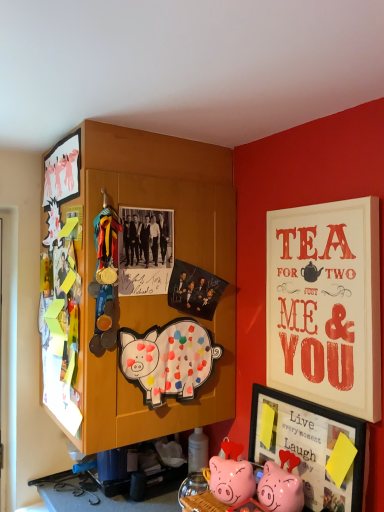
What are the coordinates of `matte black picture frame at lower right, which ranks as the third picture frame in top-to-bottom order` in the screenshot? It's located at (310, 446).

Where is `pink glossy piggy bank at lower center, the first toy in the left-to-right sequence`? pink glossy piggy bank at lower center, the first toy in the left-to-right sequence is located at coordinates (230, 475).

What do you see at coordinates (168, 359) in the screenshot?
I see `painted paper pig at center` at bounding box center [168, 359].

The width and height of the screenshot is (384, 512). What do you see at coordinates (281, 485) in the screenshot?
I see `pink glossy piggy bank at lower center, which is counted as the second toy, starting from the left` at bounding box center [281, 485].

In order to face pink glossy piggy bank at lower center, which ranks as the first toy in right-to-left order, should I rotate leftwards or rightwards?

You should rotate right by 11.443 degrees.

I want to click on matte black picture frame at lower right, which ranks as the third picture frame in top-to-bottom order, so click(310, 446).

Which object is further away from the camera taking this photo, matte white signboard at upper right, which ranks as the first picture frame in right-to-left order, or pink glossy piggy bank at lower center, which ranks as the first toy in right-to-left order?

pink glossy piggy bank at lower center, which ranks as the first toy in right-to-left order, is more distant.

Based on the photo, considering the relative sizes of matte white signboard at upper right, which ranks as the first picture frame in right-to-left order, and pink glossy piggy bank at lower center, which ranks as the first toy in right-to-left order, in the image provided, is matte white signboard at upper right, which ranks as the first picture frame in right-to-left order, taller than pink glossy piggy bank at lower center, which ranks as the first toy in right-to-left order,?

Yes, matte white signboard at upper right, which ranks as the first picture frame in right-to-left order, is taller than pink glossy piggy bank at lower center, which ranks as the first toy in right-to-left order.

I want to click on toy that is the 1st object to the left of the matte white signboard at upper right, acting as the 2th picture frame starting from the bottom, starting at the anchor, so click(x=281, y=485).

Would you say wooden cabinet at upper left is a long distance from matte white signboard at upper right, which is the 2th picture frame in top-to-bottom order?

No, there isn't a large distance between wooden cabinet at upper left and matte white signboard at upper right, which is the 2th picture frame in top-to-bottom order.

Based on the photo, from a real-world perspective, is wooden cabinet at upper left positioned over matte white signboard at upper right, acting as the 2th picture frame starting from the bottom, based on gravity?

Yes, from a real-world perspective, wooden cabinet at upper left is on top of matte white signboard at upper right, acting as the 2th picture frame starting from the bottom.

From the image's perspective, is wooden cabinet at upper left located above or below matte white signboard at upper right, which is the 2th picture frame in top-to-bottom order?

Clearly, from the image's perspective, wooden cabinet at upper left is above matte white signboard at upper right, which is the 2th picture frame in top-to-bottom order.

How much distance is there between wooden cabinet at upper left and matte white signboard at upper right, acting as the 2th picture frame starting from the bottom?

A distance of 17.27 inches exists between wooden cabinet at upper left and matte white signboard at upper right, acting as the 2th picture frame starting from the bottom.

How different are the orientations of matte white picture frame at upper left, acting as the first picture frame starting from the top, and wooden cabinet at upper left in degrees?

90.9 degrees.

Is matte white picture frame at upper left, the 3th picture frame positioned from the right, looking in the opposite direction of wooden cabinet at upper left?

That's right, matte white picture frame at upper left, the 3th picture frame positioned from the right, is facing away from wooden cabinet at upper left.

Which is in front, wooden cabinet at upper left or pink glossy piggy bank at lower center, the first toy in the left-to-right sequence?

pink glossy piggy bank at lower center, the first toy in the left-to-right sequence, is in front.

Does point (132, 170) come farther from viewer compared to point (213, 480)?

Yes, point (132, 170) is behind point (213, 480).

You are a GUI agent. You are given a task and a screenshot of the screen. Output one action in this format:
    pyautogui.click(x=<x>, y=<y>)
    Task: Click on the cabinetry on the left of pink glossy piggy bank at lower center, the first toy in the left-to-right sequence
    The image size is (384, 512).
    Given the screenshot: What is the action you would take?
    pyautogui.click(x=174, y=254)

From a real-world perspective, which picture frame is the 1st one above the matte black picture frame at lower right, the 2th picture frame when ordered from right to left? Please provide its 2D coordinates.

[(326, 305)]

Is point (314, 447) closer to camera compared to point (290, 281)?

Yes, point (314, 447) is in front of point (290, 281).

From the picture: From the image's perspective, would you say matte black picture frame at lower right, the first picture frame positioned from the bottom, is shown under matte white signboard at upper right, which is the 2th picture frame in top-to-bottom order?

Correct, matte black picture frame at lower right, the first picture frame positioned from the bottom, appears lower than matte white signboard at upper right, which is the 2th picture frame in top-to-bottom order, in the image.

Is matte white signboard at upper right, the 3th picture frame when ordered from left to right, completely or partially inside matte black picture frame at lower right, which ranks as the third picture frame in top-to-bottom order?

Definitely not — matte white signboard at upper right, the 3th picture frame when ordered from left to right, is not inside matte black picture frame at lower right, which ranks as the third picture frame in top-to-bottom order.

In the image, is matte white signboard at upper right, which is the 2th picture frame in top-to-bottom order, on the left side or the right side of painted paper pig at center?

matte white signboard at upper right, which is the 2th picture frame in top-to-bottom order, is to the right of painted paper pig at center.

Is painted paper pig at center inside matte white signboard at upper right, acting as the 2th picture frame starting from the bottom?

Definitely not — painted paper pig at center is not inside matte white signboard at upper right, acting as the 2th picture frame starting from the bottom.

Consider the image. Considering the sizes of objects matte white signboard at upper right, which ranks as the first picture frame in right-to-left order, and painted paper pig at center in the image provided, who is taller, matte white signboard at upper right, which ranks as the first picture frame in right-to-left order, or painted paper pig at center?

With more height is matte white signboard at upper right, which ranks as the first picture frame in right-to-left order.

Is matte white signboard at upper right, which is the 2th picture frame in top-to-bottom order, positioned with its back to painted paper pig at center?

No, painted paper pig at center is not at the back of matte white signboard at upper right, which is the 2th picture frame in top-to-bottom order.

Between matte black picture frame at lower right, the 2th picture frame when ordered from right to left, and pink glossy piggy bank at lower center, which ranks as the first toy in right-to-left order, which one has more height?

Standing taller between the two is matte black picture frame at lower right, the 2th picture frame when ordered from right to left.

Is matte black picture frame at lower right, the 2th picture frame when ordered from right to left, positioned far away from pink glossy piggy bank at lower center, which ranks as the first toy in right-to-left order?

No, matte black picture frame at lower right, the 2th picture frame when ordered from right to left, is not far away from pink glossy piggy bank at lower center, which ranks as the first toy in right-to-left order.

From the image's perspective, relative to pink glossy piggy bank at lower center, which ranks as the first toy in right-to-left order, is matte black picture frame at lower right, which is the second picture frame in left-to-right order, above or below?

matte black picture frame at lower right, which is the second picture frame in left-to-right order, is situated higher than pink glossy piggy bank at lower center, which ranks as the first toy in right-to-left order, in the image.

Considering the points (287, 397) and (266, 500), which point is behind, point (287, 397) or point (266, 500)?

Point (287, 397)

Starting from the pink glossy piggy bank at lower center, which ranks as the first toy in right-to-left order, which picture frame is the 2nd one to the right? Please provide its 2D coordinates.

[(326, 305)]

This screenshot has width=384, height=512. What are the coordinates of `cabinetry above the matte white signboard at upper right, which is the 2th picture frame in top-to-bottom order (from the image's perspective)` in the screenshot? It's located at (174, 254).

Considering their positions, is matte white picture frame at upper left, the first picture frame viewed from the left, positioned further to matte black photo at upper center than painted paper pig at center?

The object further to matte black photo at upper center is matte white picture frame at upper left, the first picture frame viewed from the left.

When comparing their distances from pink glossy piggy bank at lower center, which is counted as the second toy, starting from the left, does matte white signboard at upper right, which is the 2th picture frame in top-to-bottom order, or pink glossy piggy bank at lower center, the first toy in the left-to-right sequence, seem further?

matte white signboard at upper right, which is the 2th picture frame in top-to-bottom order, is further to pink glossy piggy bank at lower center, which is counted as the second toy, starting from the left.

From the image, which object appears to be nearer to painted paper pig at center, pink glossy piggy bank at lower center, which ranks as the first toy in right-to-left order, or matte white signboard at upper right, acting as the 2th picture frame starting from the bottom?

matte white signboard at upper right, acting as the 2th picture frame starting from the bottom, lies closer to painted paper pig at center than the other object.

Looking at the image, which one is located closer to matte black picture frame at lower right, the first picture frame positioned from the bottom, wooden cabinet at upper left or matte black photo at upper center?

wooden cabinet at upper left is closer to matte black picture frame at lower right, the first picture frame positioned from the bottom.

Based on their spatial positions, is matte white signboard at upper right, which ranks as the first picture frame in right-to-left order, or pink glossy piggy bank at lower center, which ranks as the first toy in right-to-left order, closer to pink glossy piggy bank at lower center, the first toy in the left-to-right sequence?

The object closer to pink glossy piggy bank at lower center, the first toy in the left-to-right sequence, is pink glossy piggy bank at lower center, which ranks as the first toy in right-to-left order.

Which object lies nearer to the anchor point pink glossy piggy bank at lower center, which ranks as the first toy in right-to-left order, wooden cabinet at upper left or matte white signboard at upper right, acting as the 2th picture frame starting from the bottom?

Among the two, matte white signboard at upper right, acting as the 2th picture frame starting from the bottom, is located nearer to pink glossy piggy bank at lower center, which ranks as the first toy in right-to-left order.

Estimate the real-world distances between objects in this image. Which object is further from pink glossy piggy bank at lower center, the second toy positioned from the right, matte white picture frame at upper left, which is counted as the third picture frame, starting from the bottom, or painted paper pig at center?

matte white picture frame at upper left, which is counted as the third picture frame, starting from the bottom.

Considering their positions, is pink glossy piggy bank at lower center, the first toy in the left-to-right sequence, positioned further to wooden cabinet at upper left than painted paper pig at center?

Based on the image, pink glossy piggy bank at lower center, the first toy in the left-to-right sequence, appears to be further to wooden cabinet at upper left.

The height and width of the screenshot is (512, 384). I want to click on pig between matte white picture frame at upper left, the 3th picture frame positioned from the right, and pink glossy piggy bank at lower center, the second toy positioned from the right, in the vertical direction, so click(168, 359).

The width and height of the screenshot is (384, 512). In order to click on pig between matte black photo at upper center and matte black picture frame at lower right, the first picture frame positioned from the bottom, from top to bottom in this screenshot , I will do [168, 359].

Find the location of a particular element. cabinetry between matte black photo at upper center and pink glossy piggy bank at lower center, the first toy in the left-to-right sequence, from top to bottom is located at coordinates (174, 254).

Where is `poster page situated between wooden cabinet at upper left and matte white signboard at upper right, which is the 2th picture frame in top-to-bottom order, from left to right`? The height and width of the screenshot is (512, 384). poster page situated between wooden cabinet at upper left and matte white signboard at upper right, which is the 2th picture frame in top-to-bottom order, from left to right is located at coordinates (194, 290).